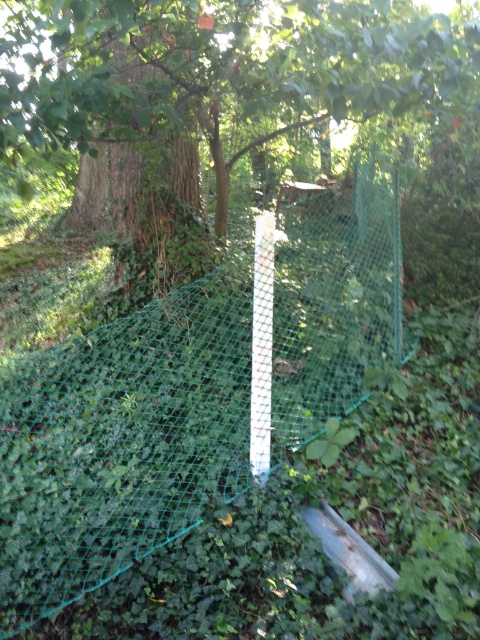
Question: Which of the following is the farthest from the observer?

Choices:
 (A) (261, 452)
 (B) (252, 301)

Answer: (B)

Question: Does green mesh fence at center appear over white plastic pole at center?

Choices:
 (A) yes
 (B) no

Answer: (A)

Question: Where is green mesh net at center located in relation to white plastic pole at center in the image?

Choices:
 (A) right
 (B) left

Answer: (B)

Question: Which object is closer to the camera taking this photo?

Choices:
 (A) white plastic pole at center
 (B) green mesh fence at center

Answer: (B)

Question: Which of the following is the closest to the observer?

Choices:
 (A) green mesh net at center
 (B) white plastic pole at center

Answer: (A)

Question: Is green mesh net at center wider than green mesh fence at center?

Choices:
 (A) yes
 (B) no

Answer: (A)